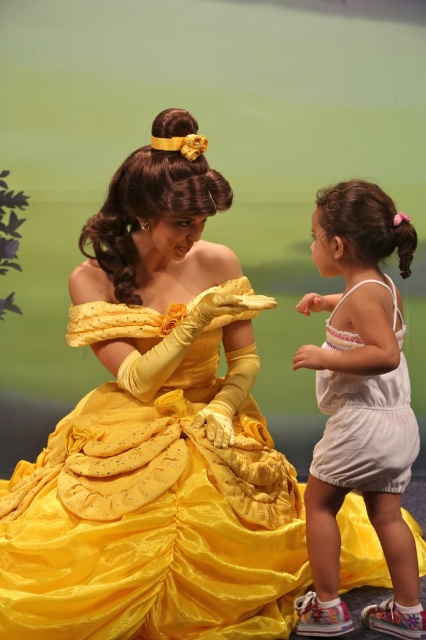
The width and height of the screenshot is (426, 640). Describe the element at coordinates (157, 435) in the screenshot. I see `matte yellow dress at center` at that location.

Who is more distant from viewer, (135,182) or (379,416)?

The point (135,182) is more distant.

Is point (187, 209) behind point (394, 445)?

No, it is in front of (394, 445).

You are a GUI agent. You are given a task and a screenshot of the screen. Output one action in this format:
    pyautogui.click(x=<x>, y=<y>)
    Task: Click on the matte yellow dress at center
    Image resolution: width=426 pixels, height=640 pixels.
    Given the screenshot: What is the action you would take?
    pyautogui.click(x=157, y=435)

Is white cotton romper at right above white cotton romper at lower right?

Actually, white cotton romper at right is below white cotton romper at lower right.

Is point (327, 620) more distant than point (409, 404)?

No.

Locate an element on the screen. The height and width of the screenshot is (640, 426). white cotton romper at right is located at coordinates (359, 406).

Does matte yellow dress at center have a greater width compared to white cotton romper at lower right?

Yes.

Is point (112, 218) closer to camera compared to point (380, 442)?

No, (112, 218) is further to viewer.

You are a GUI agent. You are given a task and a screenshot of the screen. Output one action in this format:
    pyautogui.click(x=<x>, y=<y>)
    Task: Click on the matte yellow dress at center
    
    Given the screenshot: What is the action you would take?
    pyautogui.click(x=157, y=435)